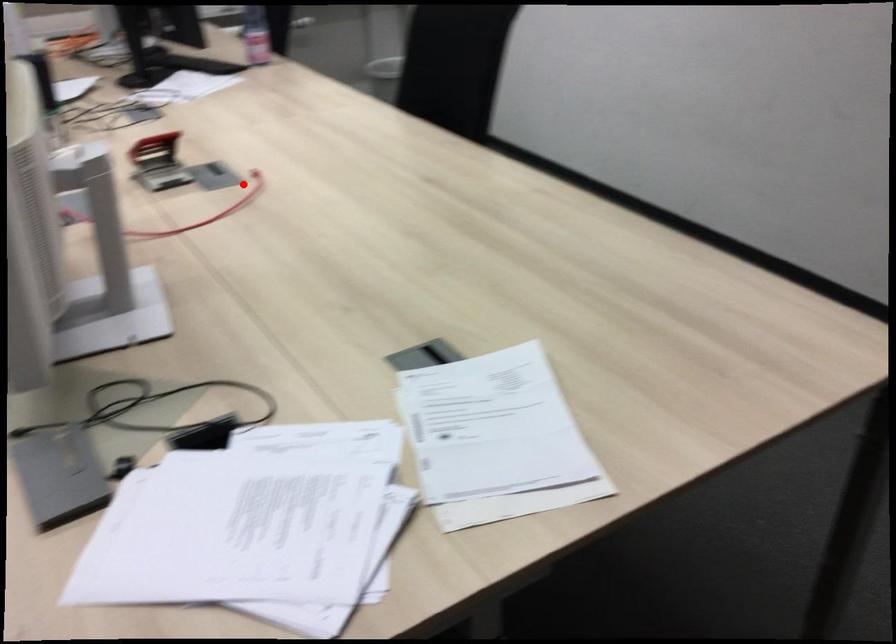
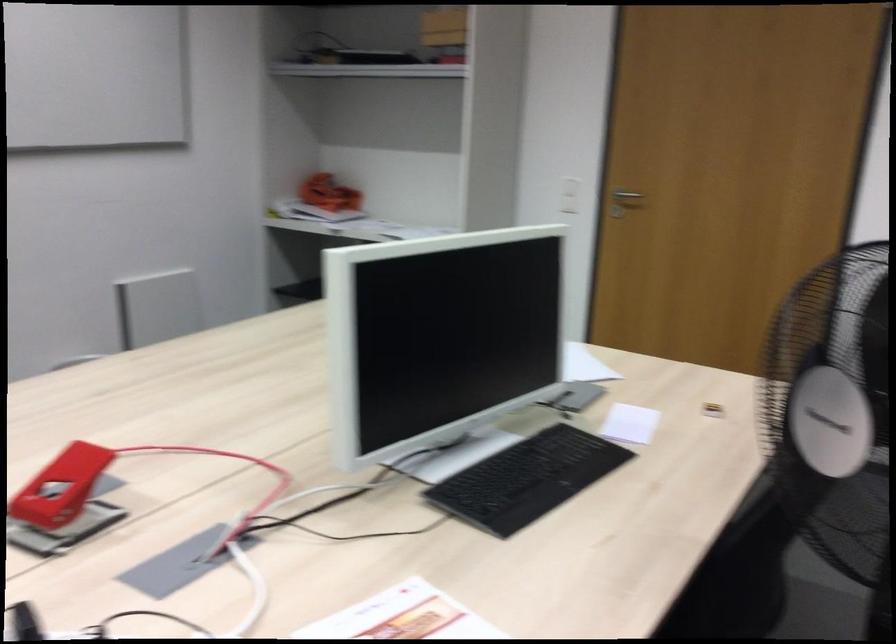
Where in the second image is the point corresponding to the highlighted location from the first image?

(101, 494)